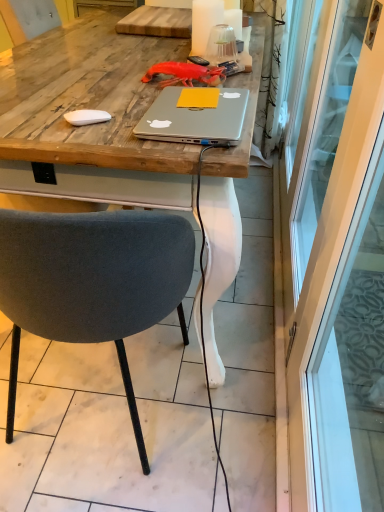
Find the location of `free point to the right of velvet grey chair at center`. free point to the right of velvet grey chair at center is located at coordinates (228, 392).